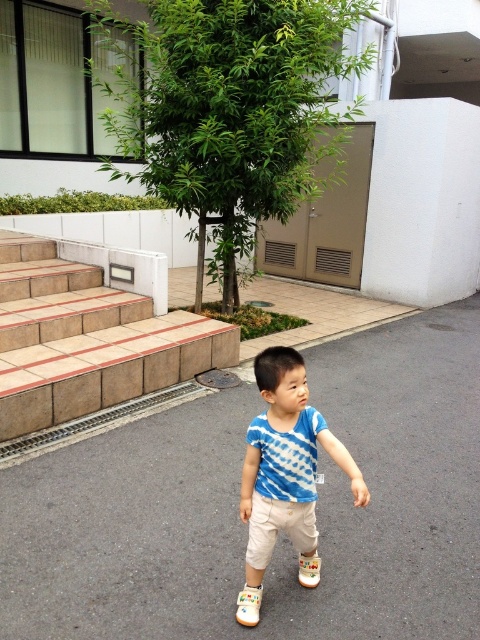
In the scene shown: Can you confirm if brown tile stairs at left is wider than white fabric shoe at center?

Yes.

Is brown tile stairs at left thinner than white fabric shoe at center?

In fact, brown tile stairs at left might be wider than white fabric shoe at center.

Locate an element on the screen. Image resolution: width=480 pixels, height=640 pixels. brown tile stairs at left is located at coordinates (87, 339).

The image size is (480, 640). What are the coordinates of `brown tile stairs at left` in the screenshot? It's located at tap(87, 339).

Is blue tie-dye shirt at center behind white fabric shoe at center?

That is False.

Does blue tie-dye shirt at center have a lesser width compared to white fabric shoe at center?

No.

Is point (264, 416) positioned in front of point (299, 577)?

Yes, it is in front of point (299, 577).

At what (x,y) coordinates should I click in order to perform the action: click on blue tie-dye shirt at center. Please return your answer as a coordinate pair (x, y). The image size is (480, 640). Looking at the image, I should click on (286, 461).

Does gray asphalt pavement at center appear over white fabric shoe at center?

Correct, gray asphalt pavement at center is located above white fabric shoe at center.

Does point (392, 582) come in front of point (314, 554)?

Yes, it is.

Find the location of a particular element. gray asphalt pavement at center is located at coordinates (244, 525).